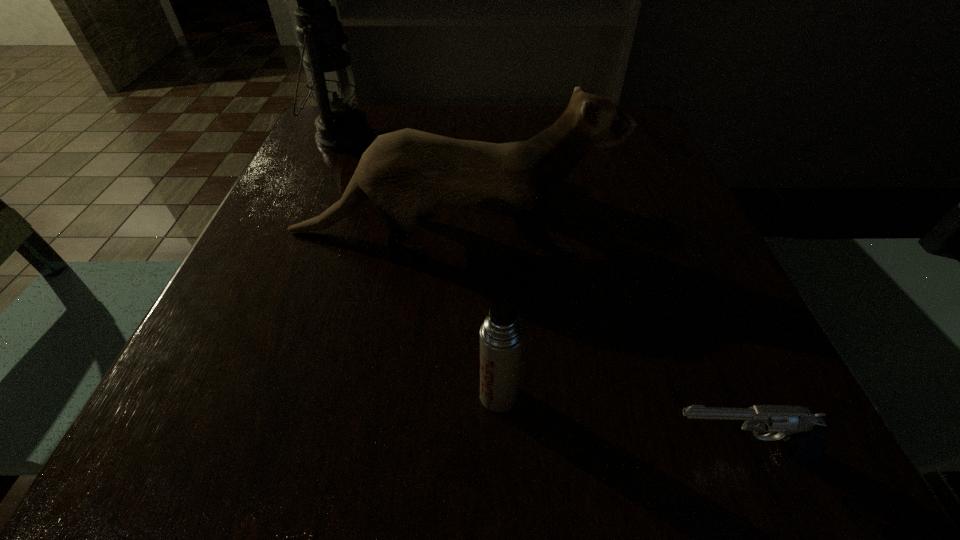
Find the location of `object present at the far left corner`. object present at the far left corner is located at coordinates (340, 127).

Locate an element on the screen. The width and height of the screenshot is (960, 540). object present at the near right corner is located at coordinates (803, 432).

The width and height of the screenshot is (960, 540). I want to click on vacant region at the far edge of the desktop, so (518, 106).

Identify the location of free space at the near edge of the desktop. This screenshot has width=960, height=540. (529, 427).

I want to click on free point at the left edge, so click(x=287, y=262).

Where is `free space at the right edge of the desktop`? free space at the right edge of the desktop is located at coordinates (749, 352).

The width and height of the screenshot is (960, 540). Identify the location of vacant position at the far left corner of the desktop. (300, 149).

Image resolution: width=960 pixels, height=540 pixels. Find the location of `free spot between the thermos bottle and the second farthest object`. free spot between the thermos bottle and the second farthest object is located at coordinates (474, 314).

In order to click on empty location between the gun and the oil lamp in this screenshot , I will do `click(539, 294)`.

The height and width of the screenshot is (540, 960). I want to click on free space between the nearest object and the second shortest object, so click(617, 423).